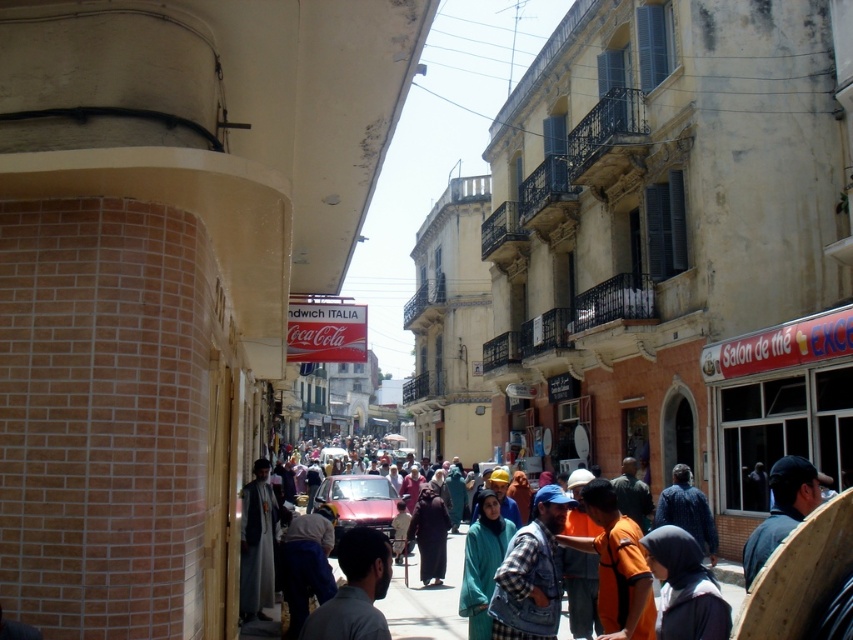
Which is more to the left, matte black hijab at lower right or dark gray shirt at center?

From the viewer's perspective, dark gray shirt at center appears more on the left side.

Based on the photo, is matte black hijab at lower right shorter than dark gray shirt at center?

Incorrect, matte black hijab at lower right's height does not fall short of dark gray shirt at center's.

The image size is (853, 640). What do you see at coordinates (685, 588) in the screenshot?
I see `matte black hijab at lower right` at bounding box center [685, 588].

This screenshot has height=640, width=853. Find the location of `matte black hijab at lower right`. matte black hijab at lower right is located at coordinates (685, 588).

Can you confirm if orange fabric shirt at center is positioned above dark gray shirt at center?

Actually, orange fabric shirt at center is below dark gray shirt at center.

Does orange fabric shirt at center appear under dark gray shirt at center?

Indeed, orange fabric shirt at center is positioned under dark gray shirt at center.

Is point (631, 548) positioned behind point (341, 566)?

Yes, it is behind point (341, 566).

Where is `orange fabric shirt at center`? This screenshot has height=640, width=853. orange fabric shirt at center is located at coordinates (616, 566).

Between denim jacket at center and dark gray shirt at center, which one has more height?

denim jacket at center

Describe the element at coordinates (531, 573) in the screenshot. The width and height of the screenshot is (853, 640). I see `denim jacket at center` at that location.

I want to click on denim jacket at center, so click(x=531, y=573).